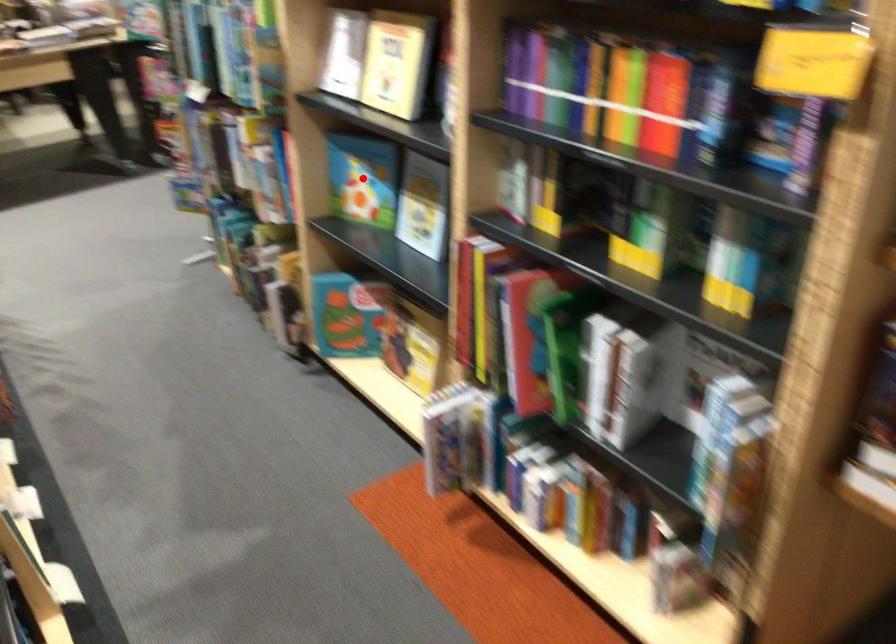
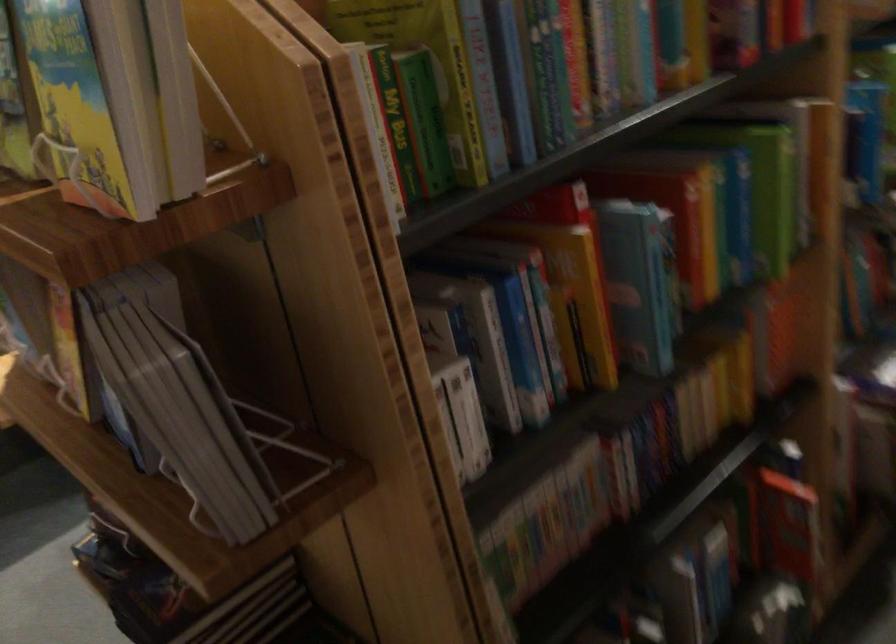
Question: I am providing you with two images of the same scene from different viewpoints. A red point is marked on the first image. Can you still see the location of the red point in image 2?

Choices:
 (A) Yes
 (B) No

Answer: (B)